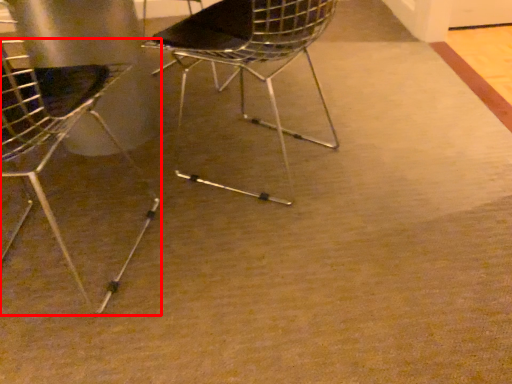
Question: Observing the image, what is the correct spatial positioning of chair (annotated by the red box) in reference to chair?

Choices:
 (A) right
 (B) left

Answer: (B)